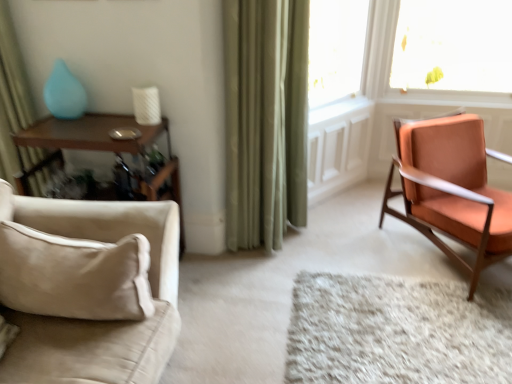
Question: Is woodenmaterial/texturetable at left looking in the opposite direction of white shag rug at center?

Choices:
 (A) yes
 (B) no

Answer: (B)

Question: Is woodenmaterial/texturetable at left outside white shag rug at center?

Choices:
 (A) no
 (B) yes

Answer: (B)

Question: Does woodenmaterial/texturetable at left come in front of white shag rug at center?

Choices:
 (A) yes
 (B) no

Answer: (B)

Question: Can you confirm if woodenmaterial/texturetable at left is shorter than white shag rug at center?

Choices:
 (A) yes
 (B) no

Answer: (B)

Question: Is woodenmaterial/texturetable at left taller than white shag rug at center?

Choices:
 (A) yes
 (B) no

Answer: (A)

Question: Is woodenmaterial/texturetable at left aimed at white shag rug at center?

Choices:
 (A) no
 (B) yes

Answer: (A)

Question: Would you say matte ceramic vase at upper left contains beige fabric couch at lower left, positioned as the 2th chair in back-to-front order?

Choices:
 (A) yes
 (B) no

Answer: (B)

Question: Considering the relative sizes of matte ceramic vase at upper left and beige fabric couch at lower left, which is the second chair in right-to-left order, in the image provided, is matte ceramic vase at upper left wider than beige fabric couch at lower left, which is the second chair in right-to-left order,?

Choices:
 (A) yes
 (B) no

Answer: (B)

Question: Is matte ceramic vase at upper left next to beige fabric couch at lower left, which is the second chair in right-to-left order, and touching it?

Choices:
 (A) no
 (B) yes

Answer: (A)

Question: Does matte ceramic vase at upper left have a larger size compared to beige fabric couch at lower left, which appears as the first chair when viewed from the left?

Choices:
 (A) no
 (B) yes

Answer: (A)

Question: From a real-world perspective, is matte ceramic vase at upper left physically below beige fabric couch at lower left, which is the second chair in right-to-left order?

Choices:
 (A) yes
 (B) no

Answer: (B)

Question: Can you confirm if matte ceramic vase at upper left is smaller than beige fabric couch at lower left, which is the second chair in right-to-left order?

Choices:
 (A) yes
 (B) no

Answer: (A)

Question: Is white shag rug at center behind orange fabric chair at right, which ranks as the 2th chair in front-to-back order?

Choices:
 (A) yes
 (B) no

Answer: (B)